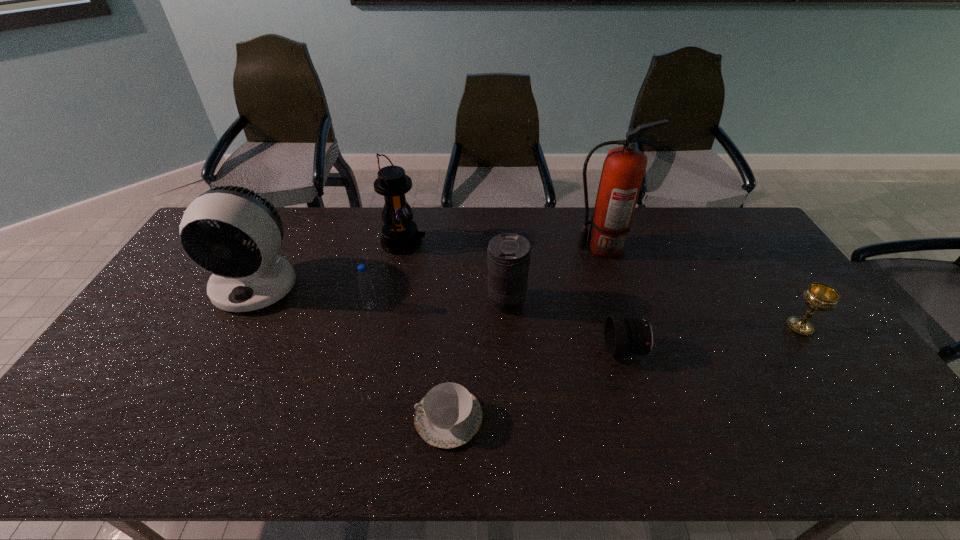
Find the location of a particular element. This screenshot has width=960, height=540. vacant space positioned on the front of the rightmost object is located at coordinates (851, 402).

Locate an element on the screen. Image resolution: width=960 pixels, height=540 pixels. vacant area located 0.070m at the front element of the second shortest object is located at coordinates (580, 350).

Image resolution: width=960 pixels, height=540 pixels. I want to click on blank space located 0.320m at the front element of the second shortest object, so click(x=489, y=350).

Identify the location of blank space located 0.180m at the front element of the second shortest object. (540, 350).

Locate an element on the screen. This screenshot has height=540, width=960. free space located on the handle side of the nearest object is located at coordinates (312, 418).

At what (x,y) coordinates should I click in order to perform the action: click on vacant area located on the handle side of the nearest object. Please return your answer as a coordinate pair (x, y). Looking at the image, I should click on (332, 418).

Image resolution: width=960 pixels, height=540 pixels. Identify the location of vacant region located on the handle side of the nearest object. (262, 418).

This screenshot has width=960, height=540. What are the coordinates of `fire extinguisher positioned at the far edge` in the screenshot? It's located at (623, 170).

This screenshot has height=540, width=960. Identify the location of lantern that is at the far edge. (400, 235).

Locate an element on the screen. The width and height of the screenshot is (960, 540). object located at the near edge is located at coordinates (448, 416).